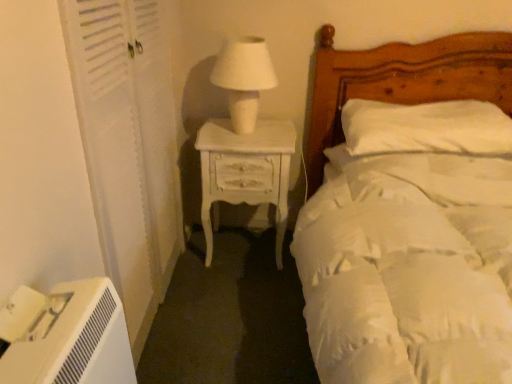
The image size is (512, 384). What do you see at coordinates (407, 220) in the screenshot?
I see `white soft bed at upper right` at bounding box center [407, 220].

In order to click on white soft pillow at upper right in this screenshot , I will do `click(426, 128)`.

Identify the location of white painted wood nightstand at center left. (245, 172).

Identify the location of white soft bed at upper right. (407, 220).

Is white wooden screen door at left facing towards white matte table lamp at center?

Yes, white wooden screen door at left is turned towards white matte table lamp at center.

Looking at this image, does white wooden screen door at left have a lesser height compared to white matte table lamp at center?

No, white wooden screen door at left is not shorter than white matte table lamp at center.

Looking at this image, from a real-world perspective, which is physically below, white wooden screen door at left or white matte table lamp at center?

white wooden screen door at left is physically lower.

Is white wooden screen door at left closer to the viewer compared to white matte table lamp at center?

Yes, white wooden screen door at left is in front of white matte table lamp at center.

From a real-world perspective, which is physically above, white painted wood nightstand at center left or white matte table lamp at center?

white matte table lamp at center.

Which is farther, (214,226) or (246,114)?

The point (214,226) is more distant.

From the image's perspective, is white soft pillow at upper right located above or below white painted wood nightstand at center left?

white soft pillow at upper right is situated higher than white painted wood nightstand at center left in the image.

Is white soft pillow at upper right outside of white painted wood nightstand at center left?

Absolutely, white soft pillow at upper right is external to white painted wood nightstand at center left.

Which point is more distant from viewer, (375,145) or (210,150)?

The point (210,150) is farther from the camera.

Would you say white soft pillow at upper right is a long distance from white painted wood nightstand at center left?

No, white soft pillow at upper right is not far from white painted wood nightstand at center left.

Is white painted wood nightstand at center left in contact with white soft bed at upper right?

white painted wood nightstand at center left and white soft bed at upper right are not in contact.

Is white painted wood nightstand at center left shorter than white soft bed at upper right?

Yes.

What's the angular difference between white painted wood nightstand at center left and white soft bed at upper right's facing directions?

white painted wood nightstand at center left and white soft bed at upper right are facing 0.208 degrees away from each other.

Is white wooden screen door at left thinner than white soft bed at upper right?

Indeed, white wooden screen door at left has a lesser width compared to white soft bed at upper right.

Can you confirm if white wooden screen door at left is taller than white soft bed at upper right?

Yes.

Which object is closer to the camera, white wooden screen door at left or white soft bed at upper right?

white soft bed at upper right.

From the image's perspective, does white wooden screen door at left appear lower than white soft bed at upper right?

No.

Could you measure the distance between white wooden screen door at left and white painted wood nightstand at center left?

white wooden screen door at left is 17.95 inches from white painted wood nightstand at center left.

From the image's perspective, is white wooden screen door at left positioned above or below white painted wood nightstand at center left?

From the image's perspective, white wooden screen door at left appears above white painted wood nightstand at center left.

Can you see white wooden screen door at left touching white painted wood nightstand at center left?

No, white wooden screen door at left is not making contact with white painted wood nightstand at center left.

At what (x,y) coordinates should I click in order to perform the action: click on nightstand below the white wooden screen door at left (from the image's perspective). Please return your answer as a coordinate pair (x, y). Looking at the image, I should click on (245, 172).

From a real-world perspective, is white painted wood nightstand at center left physically above white wooden screen door at left?

Actually, white painted wood nightstand at center left is physically below white wooden screen door at left in the real world.

From the image's perspective, is white painted wood nightstand at center left on white wooden screen door at left?

No, from the image's perspective, white painted wood nightstand at center left is not above white wooden screen door at left.

Considering the positions of objects white painted wood nightstand at center left and white wooden screen door at left in the image provided, who is more to the left, white painted wood nightstand at center left or white wooden screen door at left?

white wooden screen door at left.

How much distance is there between white painted wood nightstand at center left and white wooden screen door at left?

A distance of 17.95 inches exists between white painted wood nightstand at center left and white wooden screen door at left.

Identify the location of table lamp located on the right of white wooden screen door at left. (244, 79).

The height and width of the screenshot is (384, 512). Identify the location of nightstand below the white matte table lamp at center (from the image's perspective). (245, 172).

From the image, which object appears to be nearer to white soft bed at upper right, white soft pillow at upper right or white painted wood nightstand at center left?

white soft pillow at upper right.

Considering their positions, is white soft bed at upper right positioned closer to white wooden screen door at left than white soft pillow at upper right?

white soft bed at upper right is positioned closer to the anchor white wooden screen door at left.

Looking at the image, which one is located further to white soft bed at upper right, white soft pillow at upper right or white matte table lamp at center?

white matte table lamp at center is further to white soft bed at upper right.

Which object lies further to the anchor point white soft pillow at upper right, white soft bed at upper right or white matte table lamp at center?

white matte table lamp at center lies further to white soft pillow at upper right than the other object.

Looking at the image, which one is located further to white painted wood nightstand at center left, white soft bed at upper right or white matte table lamp at center?

white soft bed at upper right is further to white painted wood nightstand at center left.

Estimate the real-world distances between objects in this image. Which object is further from white soft pillow at upper right, white matte table lamp at center or white soft bed at upper right?

Based on the image, white matte table lamp at center appears to be further to white soft pillow at upper right.

When comparing their distances from white soft bed at upper right, does white soft pillow at upper right or white wooden screen door at left seem closer?

The object closer to white soft bed at upper right is white soft pillow at upper right.

Looking at the image, which one is located closer to white painted wood nightstand at center left, white matte table lamp at center or white soft pillow at upper right?

white matte table lamp at center is closer to white painted wood nightstand at center left.

The width and height of the screenshot is (512, 384). Identify the location of table lamp situated between white wooden screen door at left and white soft pillow at upper right from left to right. (244, 79).

Locate an element on the screen. Image resolution: width=512 pixels, height=384 pixels. table lamp between white soft bed at upper right and white soft pillow at upper right along the z-axis is located at coordinates (244, 79).

The image size is (512, 384). I want to click on nightstand located between white wooden screen door at left and white soft pillow at upper right in the left-right direction, so click(x=245, y=172).

Where is `screen door between white soft bed at upper right and white soft pillow at upper right from front to back`? The width and height of the screenshot is (512, 384). screen door between white soft bed at upper right and white soft pillow at upper right from front to back is located at coordinates (128, 146).